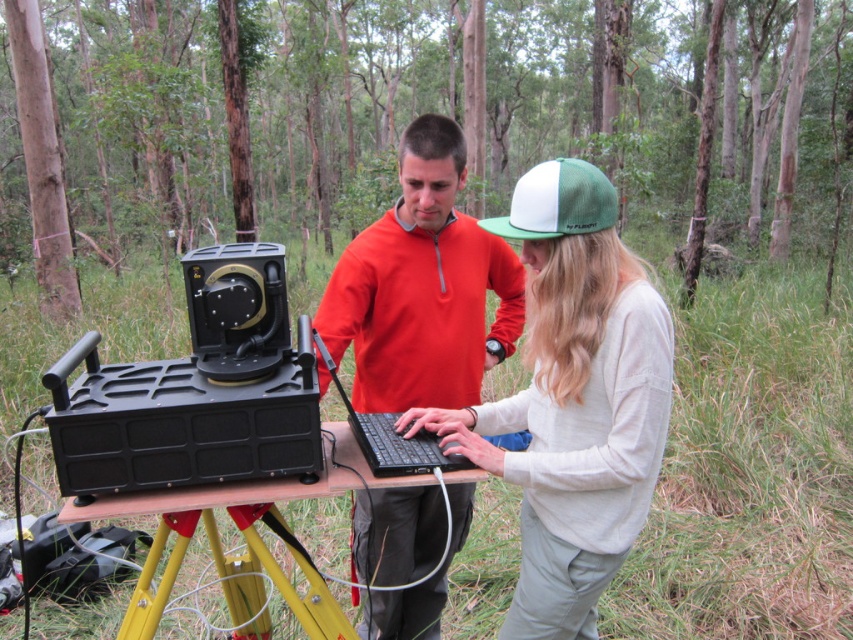
You are standing in a wooded area and see a point marked at coordinates (550, 104). What does this point indicate?

The point at coordinates (550, 104) indicates the green matte forest at center.

You are a photographer planning to take a portrait of both individuals while ensuring their clothing and the equipment are clearly visible. Given the spatial arrangement between the white knit sweater at center and the black matte laptop at center, which object should be placed closer to the camera to avoid blurring due to depth of field limitations?

The white knit sweater at center should be placed closer to the camera because its width surpasses the black matte laptop at center, ensuring both objects remain in focus within the depth of field.